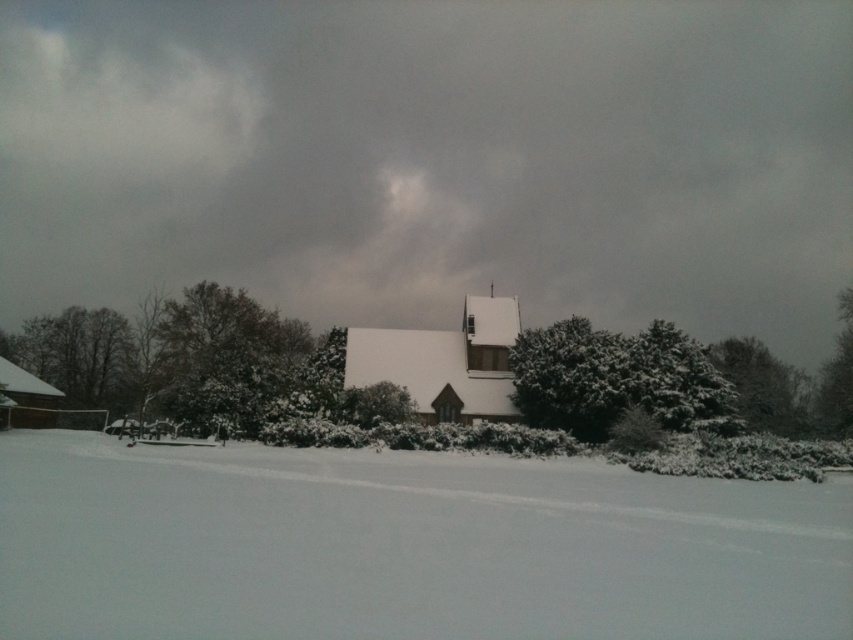
You are standing at the point marked as point (405,547) in the winter scene. What do you see directly beneath your feet?

At point (405,547) lies white fluffy snow at lower center.

You are standing in front of the small white building and want to determine which tree is closer to you. Both the snowy evergreen tree at right and the green textured tree at right are visible. Which tree is closer based on their height?

The snowy evergreen tree at right is shorter than the green textured tree at right, so the snowy evergreen tree at right is closer to you because in a snowy landscape, closer objects appear smaller or shorter due to perspective.

You are standing at the point labeled as point (x=763, y=387) in the winter scene. What object are you currently standing on?

You are standing on the snowy evergreen tree at right.